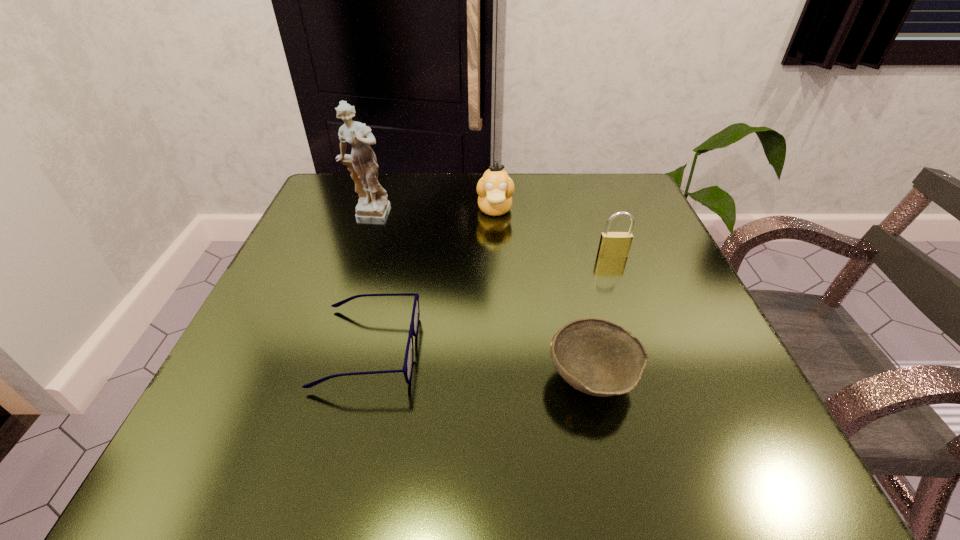
In the image, there is a desktop. At what (x,y) coordinates should I click in order to perform the action: click on vacant area at the far edge. Please return your answer as a coordinate pair (x, y). The image size is (960, 540). Looking at the image, I should click on (525, 192).

Identify the location of free space at the near edge of the desktop. This screenshot has width=960, height=540. (x=523, y=428).

This screenshot has width=960, height=540. In order to click on free space at the left edge of the desktop in this screenshot , I will do `click(315, 313)`.

Image resolution: width=960 pixels, height=540 pixels. What are the coordinates of `vacant space at the right edge of the desktop` in the screenshot? It's located at (709, 323).

In the image, there is a desktop. Where is `vacant space at the far left corner`? vacant space at the far left corner is located at coordinates (328, 176).

Identify the location of unoccupied position between the shortest object and the padlock. This screenshot has width=960, height=540. (491, 301).

Locate an element on the screen. free spot between the tallest object and the spectacles is located at coordinates (368, 283).

Locate an element on the screen. vacant space in between the third object from right to left and the second shortest object is located at coordinates (543, 294).

I want to click on vacant region between the tallest object and the shortest object, so pyautogui.click(x=368, y=283).

Where is `vacant space that's between the tallest object and the padlock`? vacant space that's between the tallest object and the padlock is located at coordinates (491, 237).